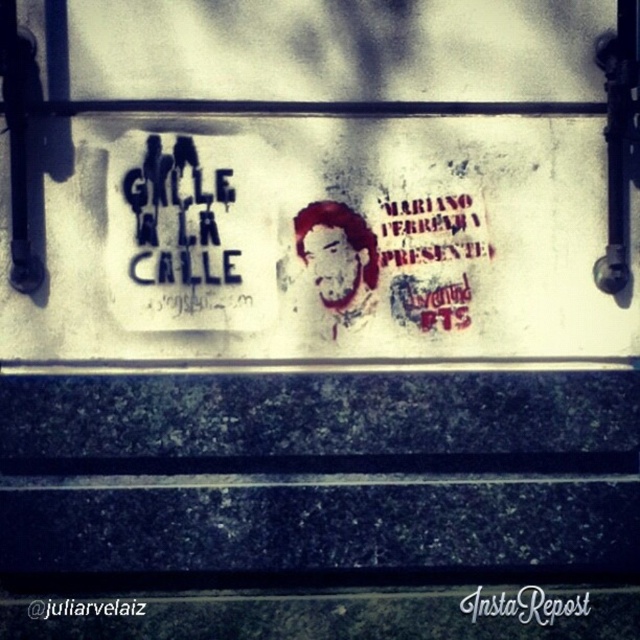
Looking at this image, does blood-stained portrait at center have a greater height compared to white paper instarepost at center?

Yes.

Which is in front, point (301, 225) or point (532, 588)?

Point (301, 225) is in front.

Is point (300, 212) positioned in front of point (547, 616)?

No, it is behind (547, 616).

Locate an element on the screen. Image resolution: width=640 pixels, height=640 pixels. blood-stained portrait at center is located at coordinates (337, 259).